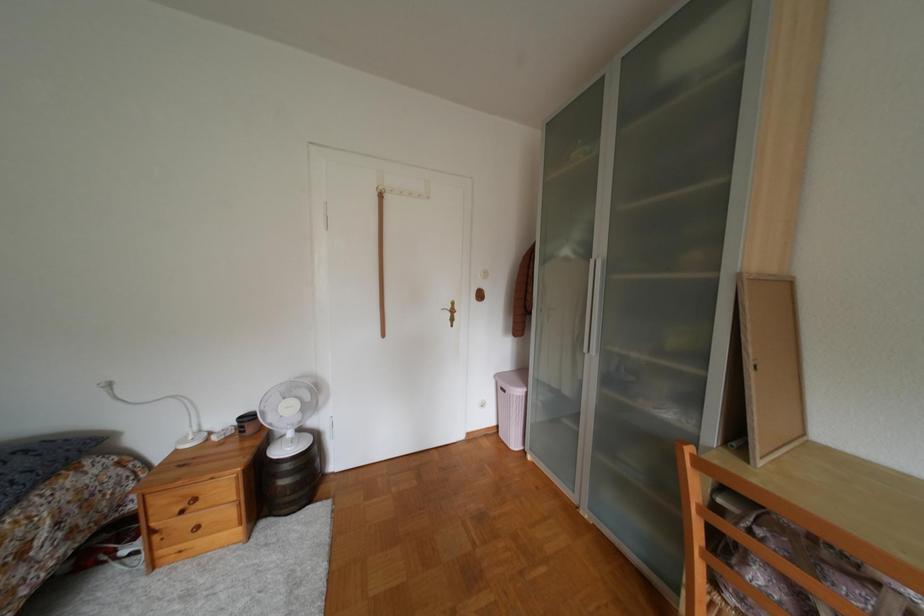
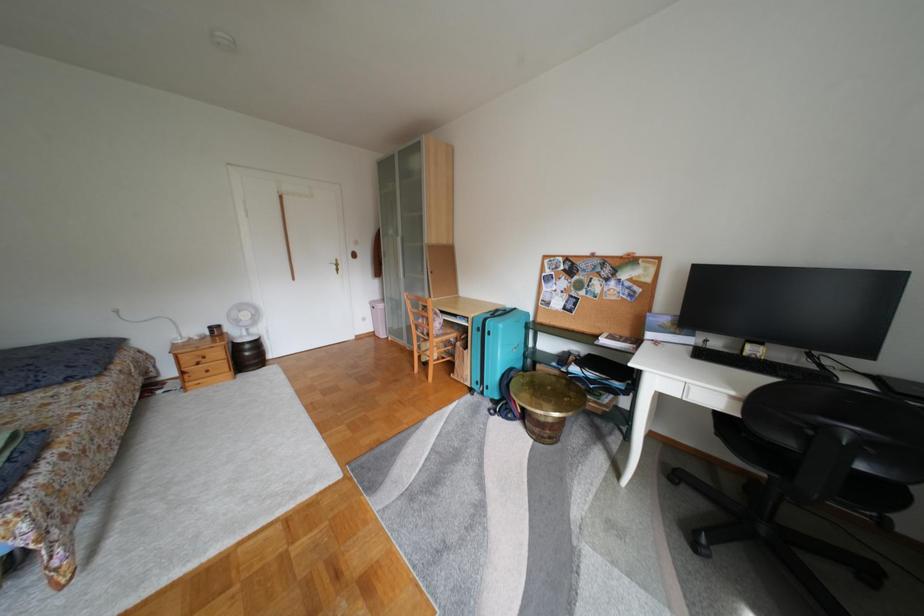
Question: In a continuous first-person perspective shot, in which direction is the camera moving?

Choices:
 (A) Left
 (B) Right
 (C) Forward
 (D) Backward

Answer: (D)